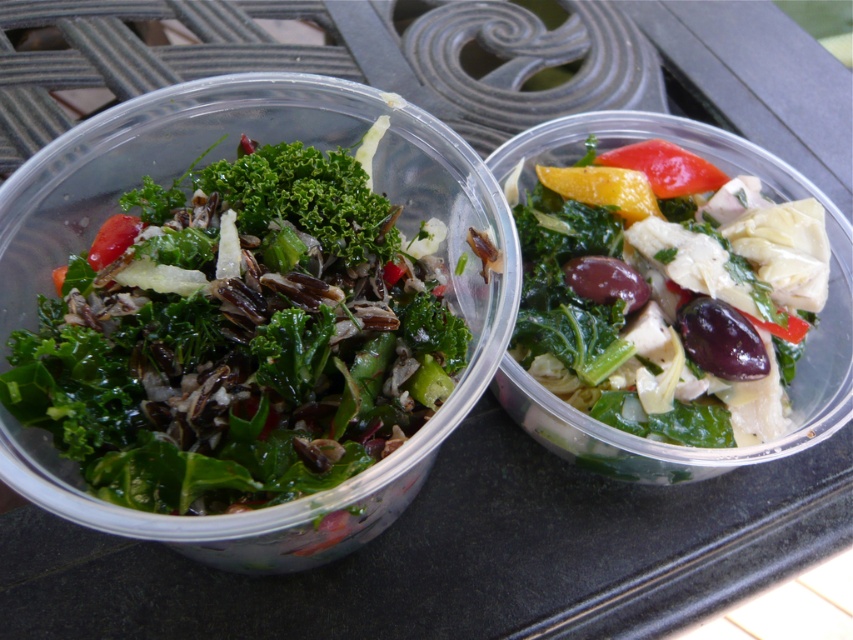
Question: Considering the real-world distances, which object is farthest from the green leafy salad at center?

Choices:
 (A) yellow matte pepper at upper center
 (B) green leafy salad at left

Answer: (B)

Question: Is green leafy salad at center bigger than yellow matte pepper at upper center?

Choices:
 (A) no
 (B) yes

Answer: (B)

Question: Which point is closer to the camera?

Choices:
 (A) yellow matte bell pepper at upper right
 (B) yellow matte pepper at upper center
 (C) green leafy salad at left

Answer: (C)

Question: Can you confirm if green leafy salad at center is thinner than yellow matte pepper at upper center?

Choices:
 (A) yes
 (B) no

Answer: (B)

Question: Which object is farther from the camera taking this photo?

Choices:
 (A) green leafy salad at center
 (B) green leafy salad at left
 (C) yellow matte pepper at upper center
 (D) yellow matte bell pepper at upper right

Answer: (D)

Question: Is green leafy salad at left positioned behind yellow matte bell pepper at upper right?

Choices:
 (A) no
 (B) yes

Answer: (A)